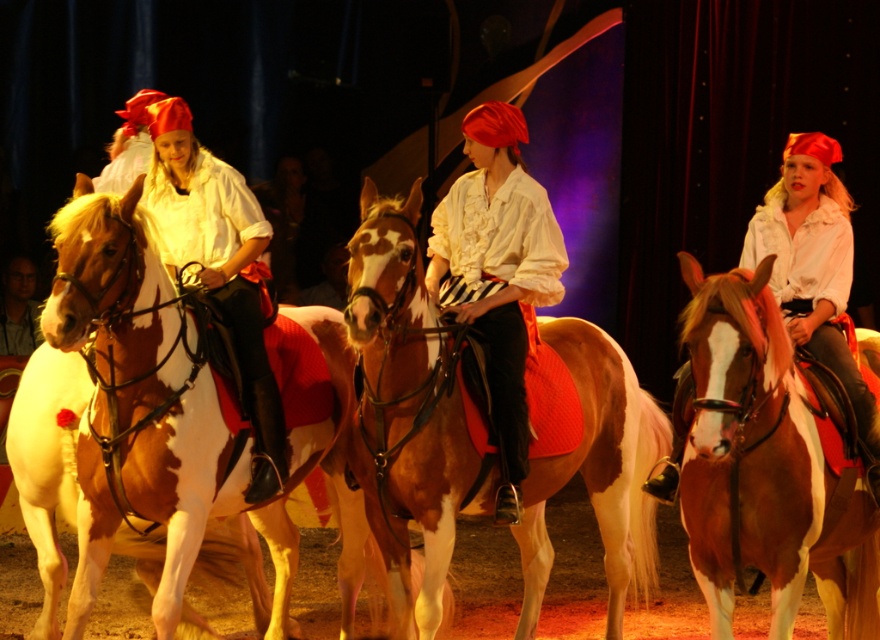
Which of these two, brown and white speckled horse at center or brown glossy horse at center, stands shorter?

brown glossy horse at center

Find the location of a particular element. Image resolution: width=880 pixels, height=640 pixels. brown and white speckled horse at center is located at coordinates [x=129, y=419].

Who is more forward, (151,378) or (695,298)?

Positioned in front is point (695,298).

Locate an element on the screen. brown and white speckled horse at center is located at coordinates (129, 419).

Is brown glossy horse at center smaller than matte white shirt at center?

Actually, brown glossy horse at center might be larger than matte white shirt at center.

Who is shorter, brown glossy horse at center or matte white shirt at center?

brown glossy horse at center

The width and height of the screenshot is (880, 640). In order to click on brown glossy horse at center in this screenshot , I will do `click(765, 467)`.

Does brown and white speckled horse at center appear over brown speckled horse at center?

Indeed, brown and white speckled horse at center is positioned over brown speckled horse at center.

Is brown and white speckled horse at center positioned at the back of brown speckled horse at center?

That is False.

Is point (62, 580) positioned in front of point (401, 564)?

No, it is not.

At what (x,y) coordinates should I click in order to perform the action: click on brown and white speckled horse at center. Please return your answer as a coordinate pair (x, y). Looking at the image, I should click on (129, 419).